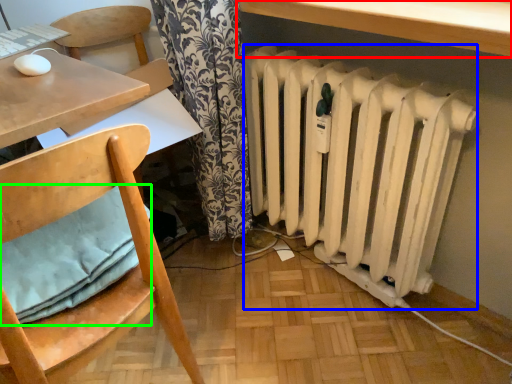
Question: Which is farther away from table (highlighted by a red box)? radiator (highlighted by a blue box) or pillow (highlighted by a green box)?

Choices:
 (A) radiator
 (B) pillow

Answer: (B)